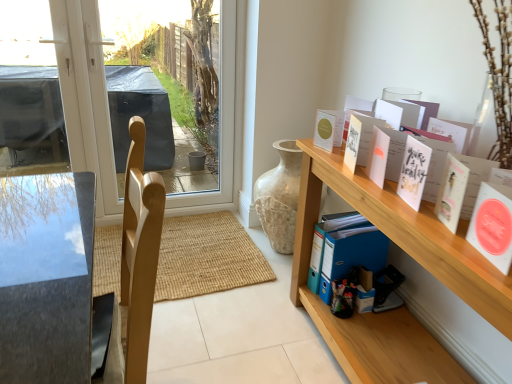
You are a GUI agent. You are given a task and a screenshot of the screen. Output one action in this format:
    pyautogui.click(x=<x>, y=<y>)
    Task: Click on the vacant area situated to the left side of white paper card at upper right, marked as the 2th book in a front-to-back arrangement
    The height and width of the screenshot is (384, 512).
    Given the screenshot: What is the action you would take?
    pyautogui.click(x=453, y=248)